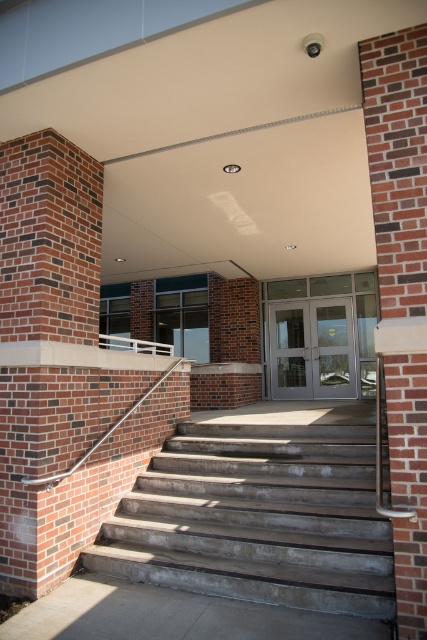
You are standing at the entrance of the building and see the point marked at coordinates point (312,349). Which object is this point located on?

The point (312,349) is located on the matte gray doors at center.

You are a delivery person approaching the entrance of the building. You need to place a heavy box on the white plastic rail at upper center. However, there is a brick at right above it. Can you safely place the box there without the brick causing an obstruction?

The brick at right is positioned over the white plastic rail at upper center, so placing the box there would be obstructed by the brick at right.

You are standing at the entrance of the building and want to know how far you are from the point marked as point (280, 321). Can you determine the distance?

The point (280, 321) is 10.77 meters from the camera, so you are 10.77 meters away from the point marked as point (280, 321).